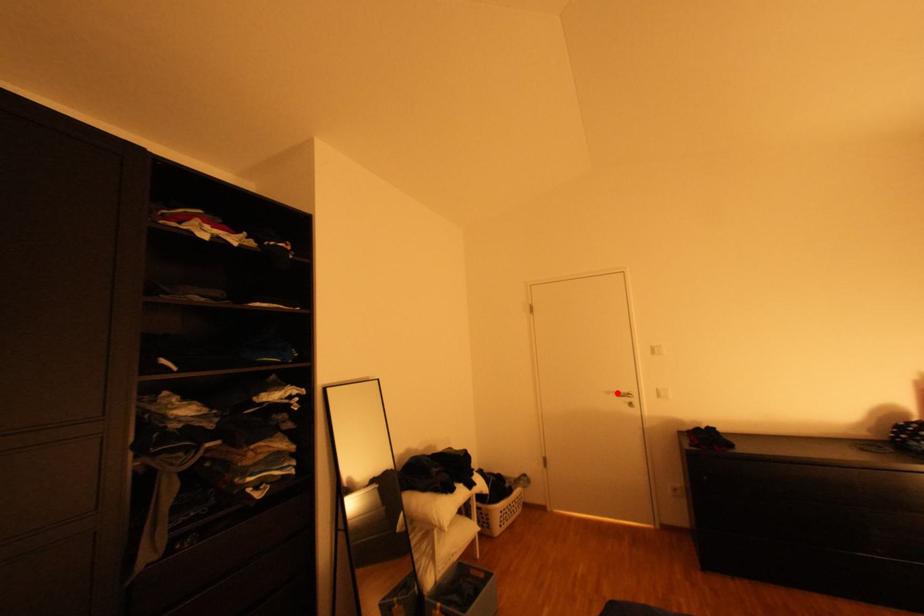
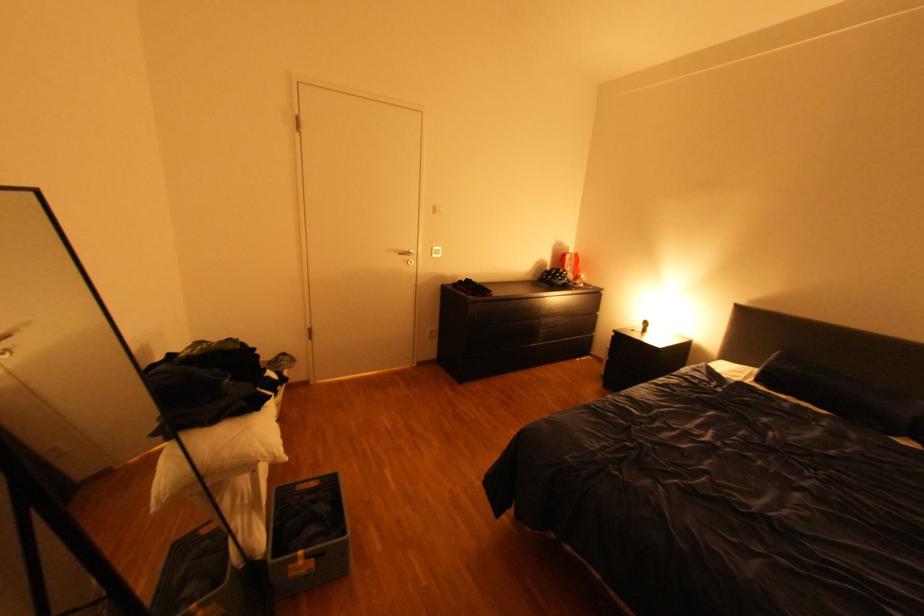
The point at the highlighted location is marked in the first image. Where is the corresponding point in the second image?

(399, 249)